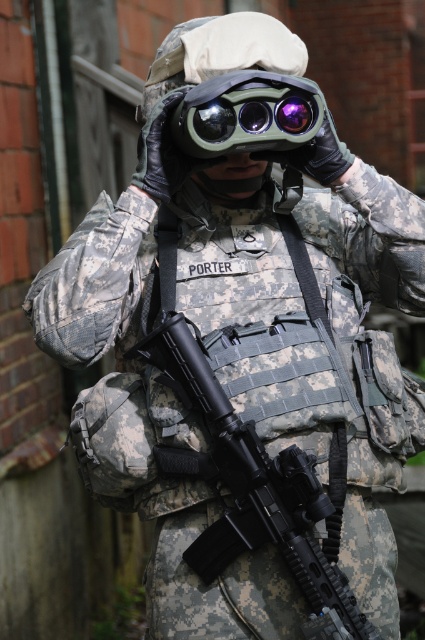
You are a military advisor assessing the equipment of a soldier in a tactical operation. The soldier is holding a black matte rifle at center and green matte binoculars at center. Which item is wider?

The black matte rifle at center is wider than the green matte binoculars at center.

You are a soldier in a tactical operation. You see two points marked on your map. The first point is at coordinate point (215, 406) and the second point is at coordinate point (201, 140). Which point is closer to your current position if you are facing north?

Point (215, 406) is in front of point (201, 140), so if you are facing north, the point (215, 406) is closer to your current position.

You are a military advisor assessing the equipment of a soldier in a tactical operation. The soldier has a black matte rifle at center and green matte binoculars at center. Which piece of equipment is taller?

The black matte rifle at center is much taller than the green matte binoculars at center.